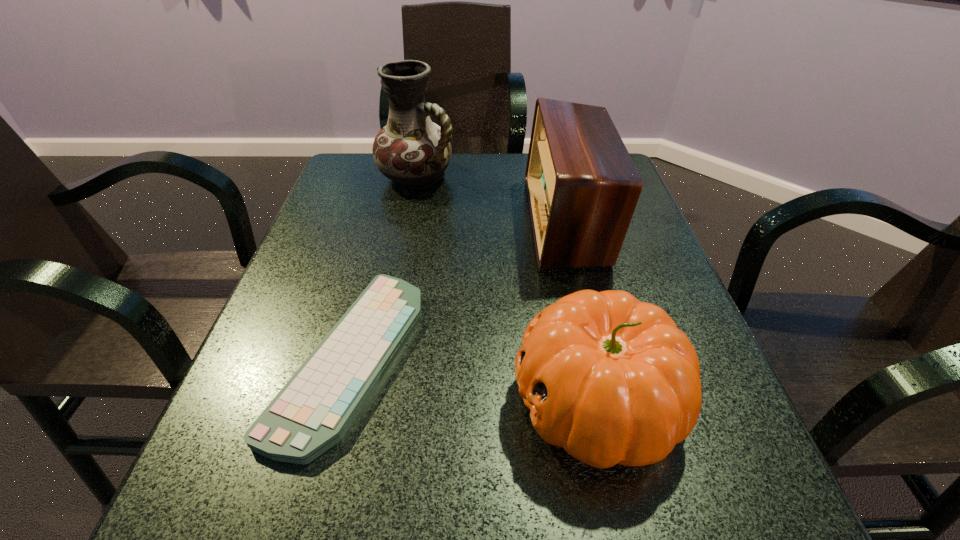
Where is `vase`? This screenshot has width=960, height=540. vase is located at coordinates pyautogui.click(x=412, y=151).

Image resolution: width=960 pixels, height=540 pixels. I want to click on the third shortest object, so click(582, 185).

Locate an element on the screen. pumpkin is located at coordinates (612, 380).

You are a GUI agent. You are given a task and a screenshot of the screen. Output one action in this format:
    pyautogui.click(x=<x>, y=<y>)
    Task: Click on the shortest object
    
    Given the screenshot: What is the action you would take?
    pyautogui.click(x=313, y=411)

This screenshot has width=960, height=540. Identify the location of free space located on the front of the vase. (396, 287).

At what (x,y) coordinates should I click in order to perform the action: click on vacant area situated 0.180m on the front-facing side of the second tallest object. Please return your answer as a coordinate pair (x, y). Image resolution: width=960 pixels, height=540 pixels. Looking at the image, I should click on (453, 220).

Where is `free point located 0.170m on the front-facing side of the second tallest object`? Image resolution: width=960 pixels, height=540 pixels. free point located 0.170m on the front-facing side of the second tallest object is located at coordinates (457, 220).

Locate an element on the screen. The height and width of the screenshot is (540, 960). free space located 0.210m on the front-facing side of the second tallest object is located at coordinates (441, 220).

Where is `free region located 0.220m on the carved face of the second shortest object`? free region located 0.220m on the carved face of the second shortest object is located at coordinates (371, 400).

Where is `free space located 0.050m on the carved face of the second shortest object`? Image resolution: width=960 pixels, height=540 pixels. free space located 0.050m on the carved face of the second shortest object is located at coordinates (480, 400).